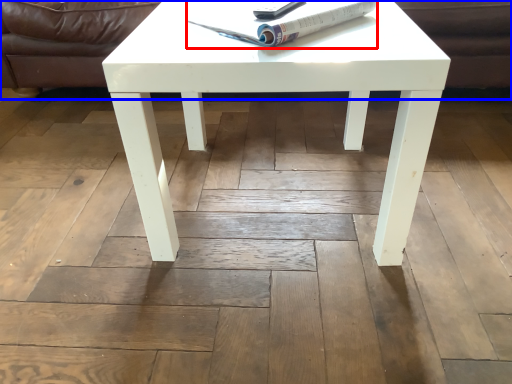
Question: Which point is further to the camera, magazine (highlighted by a red box) or couch (highlighted by a blue box)?

Choices:
 (A) magazine
 (B) couch

Answer: (B)